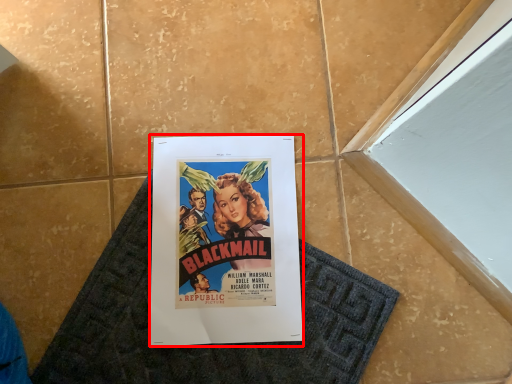
Question: From the image's perspective, what is the correct spatial positioning of poster (annotated by the red box) in reference to bath mat?

Choices:
 (A) above
 (B) below

Answer: (A)